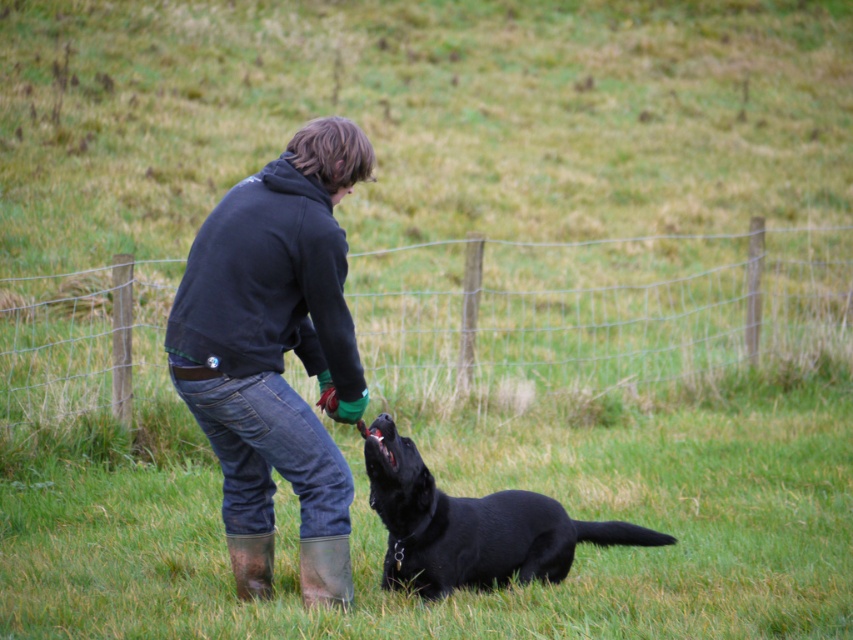
Does dark blue hoodie at center have a lesser width compared to rubber boot at lower center?

No.

Is dark blue hoodie at center to the left of rubber boot at lower center from the viewer's perspective?

Yes, dark blue hoodie at center is to the left of rubber boot at lower center.

Is point (225, 492) more distant than point (331, 573)?

That is True.

Locate an element on the screen. This screenshot has width=853, height=640. dark blue hoodie at center is located at coordinates (274, 330).

Which is in front, point (341, 589) or point (250, 598)?

Point (341, 589)

Who is taller, rubber boot at lower center or brown rubber boot at lower left?

With more height is rubber boot at lower center.

Measure the distance between point [303,582] and camera.

Point [303,582] is 6.45 meters away from camera.

Image resolution: width=853 pixels, height=640 pixels. In order to click on rubber boot at lower center in this screenshot , I will do `click(325, 572)`.

Is black cotton sweatshirt at center to the right of black matte dog at lower center from the viewer's perspective?

No, black cotton sweatshirt at center is not to the right of black matte dog at lower center.

Identify the location of black cotton sweatshirt at center. This screenshot has height=640, width=853. (268, 284).